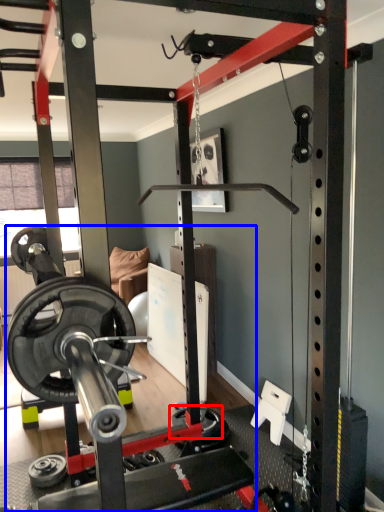
Question: Which point is further to the camera, wheel (highlighted by a red box) or barbell (highlighted by a blue box)?

Choices:
 (A) wheel
 (B) barbell

Answer: (A)